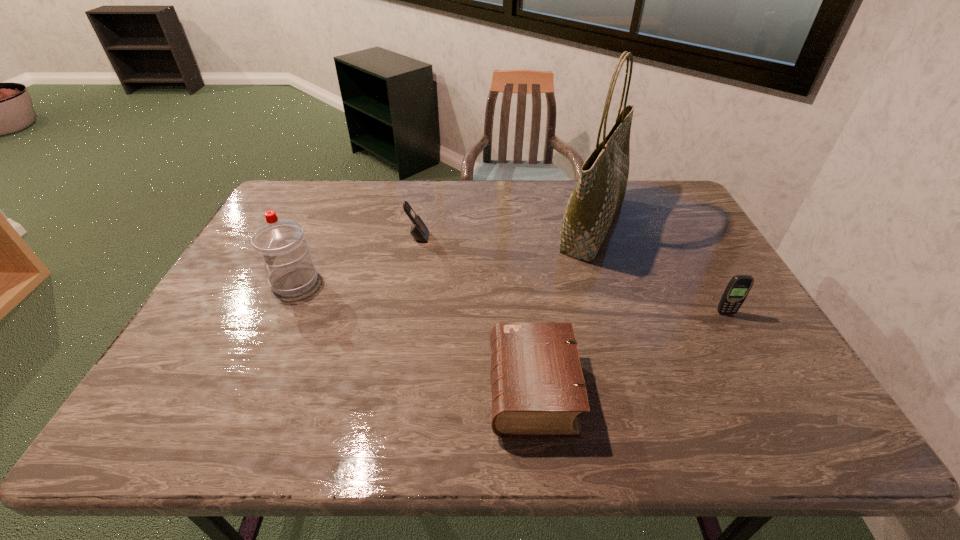
The height and width of the screenshot is (540, 960). Identify the location of empty space between the second object from right to left and the left cellular telephone. (505, 231).

Identify the location of unoccupied position between the rightmost object and the farther cellular telephone. The image size is (960, 540). (572, 275).

This screenshot has height=540, width=960. Identify the location of free space that is in between the Bible and the leftmost object. pos(414,335).

At what (x,y) coordinates should I click in order to perform the action: click on free spot between the tallest object and the fourth shortest object. Please return your answer as a coordinate pair (x, y). The width and height of the screenshot is (960, 540). Looking at the image, I should click on (444, 254).

Image resolution: width=960 pixels, height=540 pixels. Find the location of `vacant region between the second nearest object and the left cellular telephone`. vacant region between the second nearest object and the left cellular telephone is located at coordinates (572, 275).

At what (x,y) coordinates should I click in order to perform the action: click on vacant space that's between the fourth object from left to right and the rightmost object. Please return your answer as a coordinate pair (x, y). The width and height of the screenshot is (960, 540). Looking at the image, I should click on (660, 269).

Locate an element on the screen. This screenshot has height=540, width=960. free space between the fourth farthest object and the second object from right to left is located at coordinates (660, 269).

Find the location of `object that is the fourth closest one to the nearest object`. object that is the fourth closest one to the nearest object is located at coordinates (281, 243).

Identify which object is the third closest to the leftmost object. Please provide its 2D coordinates. Your answer should be formatted as a tuple, i.e. [(x, y)], where the tuple contains the x and y coordinates of a point satisfying the conditions above.

[(600, 191)]

The image size is (960, 540). Identify the location of vacant position in the image that satisfies the following two spatial constraints: 1. on the screen of the fourth farthest object; 2. on the spine side of the Bible. (769, 390).